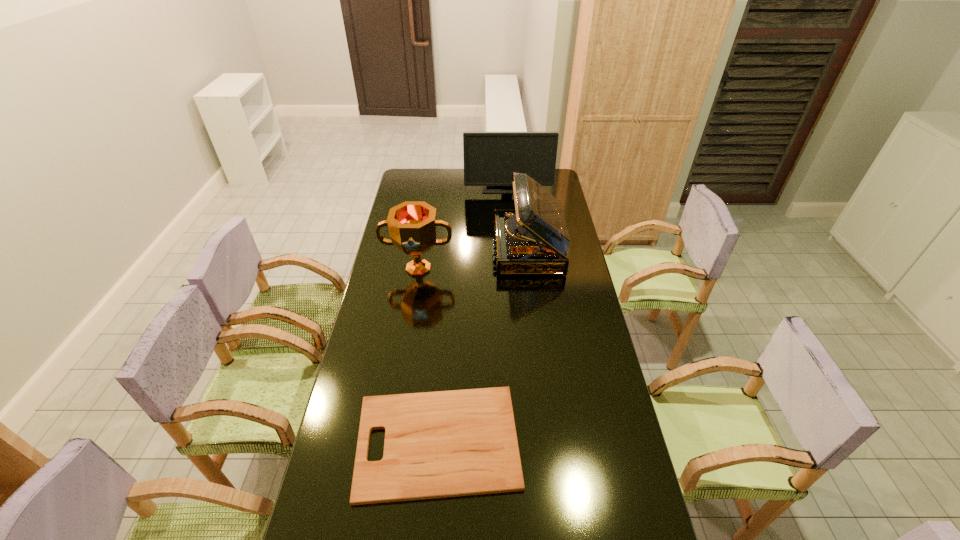
The width and height of the screenshot is (960, 540). What are the coordinates of `vacant space at the far left corner of the desktop` in the screenshot? It's located at pos(425,170).

Where is `free space between the computer monitor and the award`? This screenshot has height=540, width=960. free space between the computer monitor and the award is located at coordinates (463, 227).

The width and height of the screenshot is (960, 540). In order to click on vacant point located between the shortest object and the farthest object in this screenshot , I will do click(x=472, y=314).

You are a GUI agent. You are given a task and a screenshot of the screen. Output one action in this format:
    pyautogui.click(x=<x>, y=<y>)
    Task: Click on the free space between the nearest object and the record player
    The width and height of the screenshot is (960, 540).
    Given the screenshot: What is the action you would take?
    coord(483,345)

Find the location of a particular element. free area in between the record player and the award is located at coordinates (473, 259).

At what (x,y) coordinates should I click in order to perform the action: click on free spot between the award and the record player. Please return your answer as a coordinate pair (x, y). This screenshot has height=540, width=960. Looking at the image, I should click on click(473, 259).

This screenshot has width=960, height=540. I want to click on vacant area that lies between the award and the shortest object, so click(428, 355).

You are a GUI agent. You are given a task and a screenshot of the screen. Output one action in this format:
    pyautogui.click(x=<x>, y=<y>)
    Task: Click on the vacant area that lies between the award and the shortest object
    This screenshot has width=960, height=540.
    Given the screenshot: What is the action you would take?
    pyautogui.click(x=428, y=355)

Find the location of `vacant area that lies between the award and the chopping board`. vacant area that lies between the award and the chopping board is located at coordinates (428, 355).

The image size is (960, 540). I want to click on object that is the closest to the record player, so click(x=412, y=225).